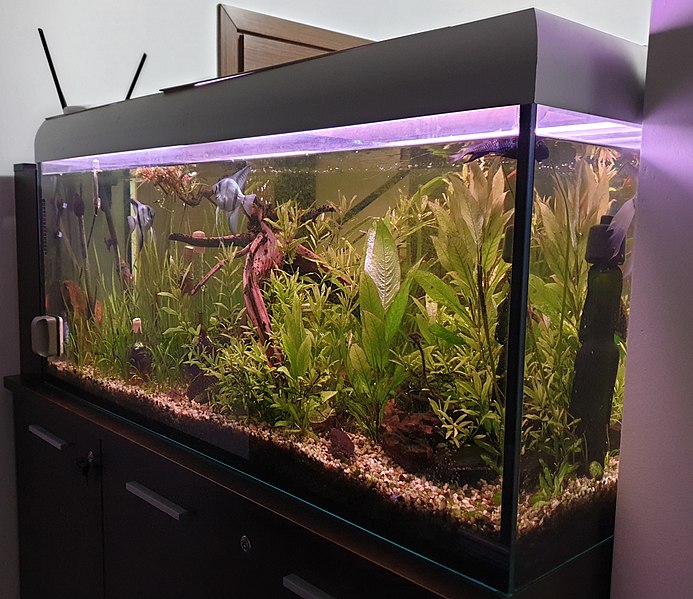
Where is `background wall`? Image resolution: width=693 pixels, height=599 pixels. background wall is located at coordinates (12, 139).